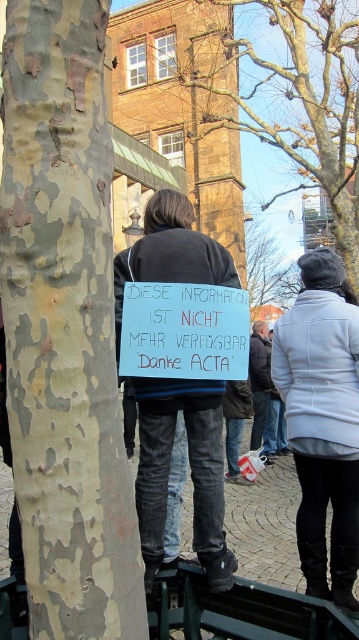
Is point (221, 90) more distant than point (208, 456)?

Yes, point (221, 90) is farther from viewer.

Who is taller, camouflage bark tree at center or denim jeans at center?

camouflage bark tree at center

At what (x,y) coordinates should I click in order to perform the action: click on camouflage bark tree at center. Please return your answer as a coordinate pair (x, y). Looking at the image, I should click on (244, 104).

Is greenish-brown textured bark at left closer to camera compared to blue paper sign at center?

Yes.

Find the location of a particular element. The height and width of the screenshot is (640, 359). greenish-brown textured bark at left is located at coordinates (64, 326).

I want to click on greenish-brown textured bark at left, so click(x=64, y=326).

Between greenish-brown textured bark at left and camouflage bark tree at center, which one has less height?

greenish-brown textured bark at left

Can you confirm if greenish-brown textured bark at left is bigger than camouflage bark tree at center?

No, greenish-brown textured bark at left is not bigger than camouflage bark tree at center.

Where is `greenish-brown textured bark at left`? The height and width of the screenshot is (640, 359). greenish-brown textured bark at left is located at coordinates (64, 326).